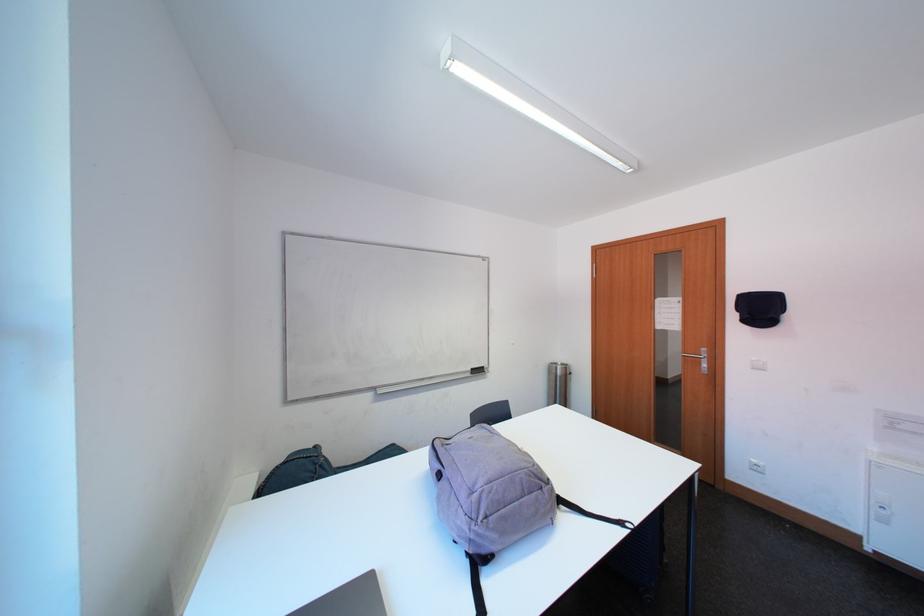
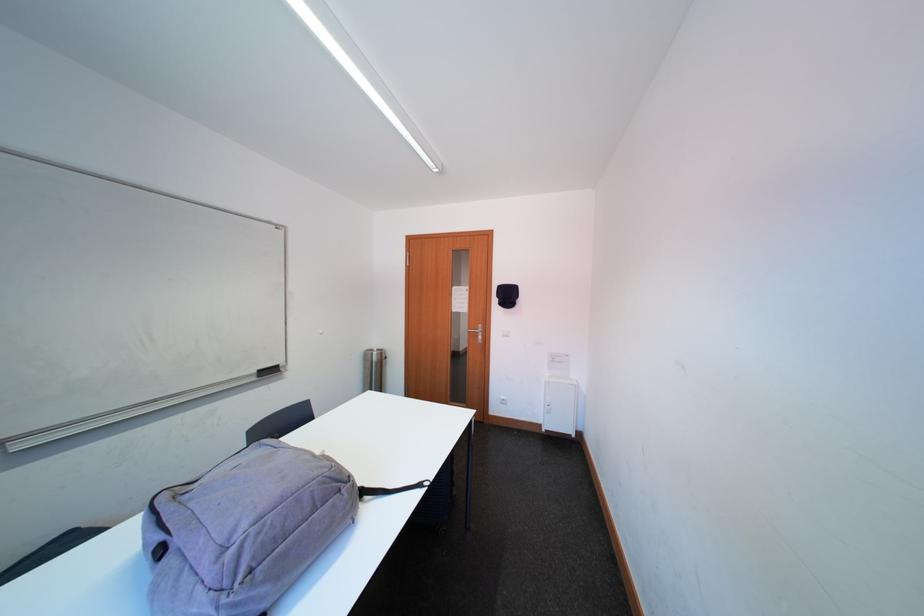
Locate, in the second image, the point that corresponds to point (551, 492) in the first image.

(349, 493)